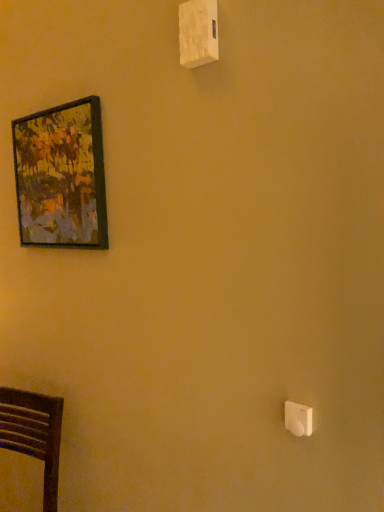
Identify the location of dark wood chair at lower left. The height and width of the screenshot is (512, 384). (34, 433).

Find the location of `white plastic light switch at upper center, which appears as the 2th light switch when viewed from the right`. white plastic light switch at upper center, which appears as the 2th light switch when viewed from the right is located at coordinates (198, 33).

This screenshot has width=384, height=512. Identify the location of white plastic light switch at lower right, which is the second light switch in back-to-front order. (298, 419).

From the image's perspective, is white plastic light switch at upper center, the 1th light switch in the left-to-right sequence, above or below white plastic light switch at lower right, marked as the first light switch in a front-to-back arrangement?

Based on their image positions, white plastic light switch at upper center, the 1th light switch in the left-to-right sequence, is located above white plastic light switch at lower right, marked as the first light switch in a front-to-back arrangement.

Is white plastic light switch at upper center, which appears as the 2th light switch when viewed from the right, inside the boundaries of white plastic light switch at lower right, marked as the first light switch in a front-to-back arrangement, or outside?

white plastic light switch at upper center, which appears as the 2th light switch when viewed from the right, cannot be found inside white plastic light switch at lower right, marked as the first light switch in a front-to-back arrangement.

Consider the image. Which of these two, white plastic light switch at upper center, placed as the second light switch when sorted from front to back, or white plastic light switch at lower right, arranged as the first light switch when ordered from the bottom, stands taller?

white plastic light switch at upper center, placed as the second light switch when sorted from front to back.

Which object is positioned more to the left, white plastic light switch at upper center, marked as the 1th light switch in a top-to-bottom arrangement, or white plastic light switch at lower right, arranged as the first light switch when ordered from the bottom?

From the viewer's perspective, white plastic light switch at upper center, marked as the 1th light switch in a top-to-bottom arrangement, appears more on the left side.

How far apart are dark wood chair at lower left and wooden-framed painting at upper left?

dark wood chair at lower left is 33.67 inches away from wooden-framed painting at upper left.

Does dark wood chair at lower left lie behind wooden-framed painting at upper left?

No, dark wood chair at lower left is closer to the viewer.

Can you confirm if dark wood chair at lower left is taller than wooden-framed painting at upper left?

Indeed, dark wood chair at lower left has a greater height compared to wooden-framed painting at upper left.

Is point (35, 438) less distant than point (202, 50)?

No, (35, 438) is further to viewer.

This screenshot has height=512, width=384. Identify the location of furniture on the left of white plastic light switch at upper center, which appears as the second light switch when ordered from the bottom. (34, 433).

How many degrees apart are the facing directions of dark wood chair at lower left and white plastic light switch at upper center, which appears as the 2th light switch when viewed from the right?

dark wood chair at lower left and white plastic light switch at upper center, which appears as the 2th light switch when viewed from the right, are facing 13 degrees away from each other.

Would you consider dark wood chair at lower left to be distant from white plastic light switch at upper center, the 1th light switch in the left-to-right sequence?

Absolutely, dark wood chair at lower left is distant from white plastic light switch at upper center, the 1th light switch in the left-to-right sequence.

Can you confirm if wooden-framed painting at upper left is taller than white plastic light switch at lower right, the 1th light switch from the right?

Correct, wooden-framed painting at upper left is much taller as white plastic light switch at lower right, the 1th light switch from the right.

Based on their sizes in the image, would you say wooden-framed painting at upper left is bigger or smaller than white plastic light switch at lower right, arranged as the first light switch when ordered from the bottom?

wooden-framed painting at upper left is bigger than white plastic light switch at lower right, arranged as the first light switch when ordered from the bottom.

How many degrees apart are the facing directions of wooden-framed painting at upper left and white plastic light switch at lower right, marked as the first light switch in a front-to-back arrangement?

There is a 3.01-degree angle between the facing directions of wooden-framed painting at upper left and white plastic light switch at lower right, marked as the first light switch in a front-to-back arrangement.

Does wooden-framed painting at upper left touch white plastic light switch at lower right, the 1th light switch from the right?

No, wooden-framed painting at upper left is not with white plastic light switch at lower right, the 1th light switch from the right.

Is white plastic light switch at lower right, which is the second light switch in back-to-front order, next to dark wood chair at lower left and touching it?

white plastic light switch at lower right, which is the second light switch in back-to-front order, and dark wood chair at lower left are not in contact.

Considering the positions of objects white plastic light switch at lower right, which is the second light switch in back-to-front order, and dark wood chair at lower left in the image provided, who is more to the right, white plastic light switch at lower right, which is the second light switch in back-to-front order, or dark wood chair at lower left?

From the viewer's perspective, white plastic light switch at lower right, which is the second light switch in back-to-front order, appears more on the right side.

From a real-world perspective, is white plastic light switch at lower right, positioned as the 2th light switch in top-to-bottom order, positioned over dark wood chair at lower left based on gravity?

Indeed, from a real-world perspective, white plastic light switch at lower right, positioned as the 2th light switch in top-to-bottom order, stands above dark wood chair at lower left.

Is white plastic light switch at upper center, which appears as the 2th light switch when viewed from the right, at the back of white plastic light switch at lower right, which appears as the 2th light switch when viewed from the left?

white plastic light switch at lower right, which appears as the 2th light switch when viewed from the left, is not turned away from white plastic light switch at upper center, which appears as the 2th light switch when viewed from the right.

From the image's perspective, which one is positioned lower, white plastic light switch at lower right, which appears as the 2th light switch when viewed from the left, or white plastic light switch at upper center, which is the 1th light switch in back-to-front order?

white plastic light switch at lower right, which appears as the 2th light switch when viewed from the left, appears lower in the image.

Is white plastic light switch at upper center, the 1th light switch in the left-to-right sequence, located within white plastic light switch at lower right, the 1th light switch from the right?

Actually, white plastic light switch at upper center, the 1th light switch in the left-to-right sequence, is outside white plastic light switch at lower right, the 1th light switch from the right.

In the scene shown: Would you consider white plastic light switch at upper center, which appears as the second light switch when ordered from the bottom, to be distant from dark wood chair at lower left?

Yes, white plastic light switch at upper center, which appears as the second light switch when ordered from the bottom, and dark wood chair at lower left are located far from each other.

From a real-world perspective, which object rests below the other?

dark wood chair at lower left, from a real-world perspective.

Which of these two, white plastic light switch at upper center, marked as the 1th light switch in a top-to-bottom arrangement, or dark wood chair at lower left, stands shorter?

Standing shorter between the two is white plastic light switch at upper center, marked as the 1th light switch in a top-to-bottom arrangement.

Considering the sizes of objects white plastic light switch at upper center, marked as the 1th light switch in a top-to-bottom arrangement, and dark wood chair at lower left in the image provided, who is wider, white plastic light switch at upper center, marked as the 1th light switch in a top-to-bottom arrangement, or dark wood chair at lower left?

dark wood chair at lower left is wider.

In the image, there is a white plastic light switch at upper center, which appears as the second light switch when ordered from the bottom. Identify the location of light switch below it (from the image's perspective). The image size is (384, 512). (298, 419).

This screenshot has width=384, height=512. What are the coordinates of `picture frame located behind the dark wood chair at lower left` in the screenshot? It's located at (61, 176).

Based on the photo, estimate the real-world distances between objects in this image. Which object is further from white plastic light switch at lower right, arranged as the first light switch when ordered from the bottom, white plastic light switch at upper center, placed as the second light switch when sorted from front to back, or wooden-framed painting at upper left?

wooden-framed painting at upper left is further to white plastic light switch at lower right, arranged as the first light switch when ordered from the bottom.

Looking at the image, which one is located closer to dark wood chair at lower left, wooden-framed painting at upper left or white plastic light switch at upper center, which appears as the second light switch when ordered from the bottom?

wooden-framed painting at upper left is positioned closer to the anchor dark wood chair at lower left.

Estimate the real-world distances between objects in this image. Which object is further from dark wood chair at lower left, white plastic light switch at lower right, positioned as the 2th light switch in top-to-bottom order, or white plastic light switch at upper center, which appears as the 2th light switch when viewed from the right?

Based on the image, white plastic light switch at upper center, which appears as the 2th light switch when viewed from the right, appears to be further to dark wood chair at lower left.

When comparing their distances from white plastic light switch at upper center, placed as the second light switch when sorted from front to back, does wooden-framed painting at upper left or white plastic light switch at lower right, which appears as the 2th light switch when viewed from the left, seem closer?

Among the two, wooden-framed painting at upper left is located nearer to white plastic light switch at upper center, placed as the second light switch when sorted from front to back.

When comparing their distances from white plastic light switch at upper center, which appears as the 2th light switch when viewed from the right, does dark wood chair at lower left or wooden-framed painting at upper left seem closer?

Among the two, wooden-framed painting at upper left is located nearer to white plastic light switch at upper center, which appears as the 2th light switch when viewed from the right.

Considering their positions, is white plastic light switch at lower right, which appears as the 2th light switch when viewed from the left, positioned closer to wooden-framed painting at upper left than white plastic light switch at upper center, placed as the second light switch when sorted from front to back?

The object closer to wooden-framed painting at upper left is white plastic light switch at upper center, placed as the second light switch when sorted from front to back.

When comparing their distances from wooden-framed painting at upper left, does dark wood chair at lower left or white plastic light switch at upper center, which appears as the second light switch when ordered from the bottom, seem closer?

Among the two, white plastic light switch at upper center, which appears as the second light switch when ordered from the bottom, is located nearer to wooden-framed painting at upper left.

Looking at the image, which one is located closer to white plastic light switch at upper center, which appears as the 2th light switch when viewed from the right, white plastic light switch at lower right, the 1th light switch from the right, or dark wood chair at lower left?

The object closer to white plastic light switch at upper center, which appears as the 2th light switch when viewed from the right, is white plastic light switch at lower right, the 1th light switch from the right.

I want to click on picture frame between white plastic light switch at upper center, the 1th light switch in the left-to-right sequence, and dark wood chair at lower left, in the vertical direction, so 61,176.

What are the coordinates of `light switch between wooden-framed painting at upper left and dark wood chair at lower left vertically` in the screenshot? It's located at (298, 419).

Find the location of a particular element. Image resolution: width=384 pixels, height=512 pixels. picture frame between white plastic light switch at upper center, placed as the second light switch when sorted from front to back, and white plastic light switch at lower right, the 1th light switch from the right, vertically is located at coordinates (61, 176).

The height and width of the screenshot is (512, 384). Find the location of `light switch that lies between white plastic light switch at upper center, placed as the second light switch when sorted from front to back, and dark wood chair at lower left from top to bottom`. light switch that lies between white plastic light switch at upper center, placed as the second light switch when sorted from front to back, and dark wood chair at lower left from top to bottom is located at coordinates (298, 419).